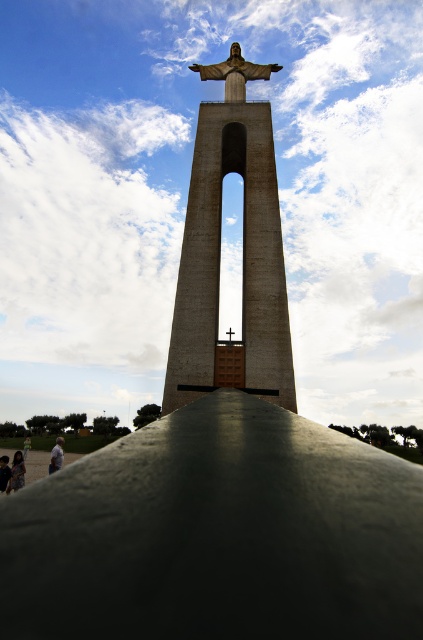
Question: Is concrete statue at center wider than light brown shirt at lower left?

Choices:
 (A) yes
 (B) no

Answer: (B)

Question: Which of these objects is positioned farthest from the dark gray concrete person at lower left?

Choices:
 (A) light brown shirt at lower left
 (B) dark skin person at lower left
 (C) light brown wooden stick at lower left
 (D) concrete statue at center

Answer: (D)

Question: Is concrete statue at center to the right of dark gray concrete person at lower left from the viewer's perspective?

Choices:
 (A) yes
 (B) no

Answer: (A)

Question: In this image, where is light brown shirt at lower left located relative to dark skin person at lower left?

Choices:
 (A) below
 (B) above

Answer: (A)

Question: Which object appears farthest from the camera in this image?

Choices:
 (A) dark skin person at lower left
 (B) light brown shirt at lower left

Answer: (B)

Question: Among these points, which one is nearest to the camera?

Choices:
 (A) (263, 291)
 (B) (60, 452)

Answer: (A)